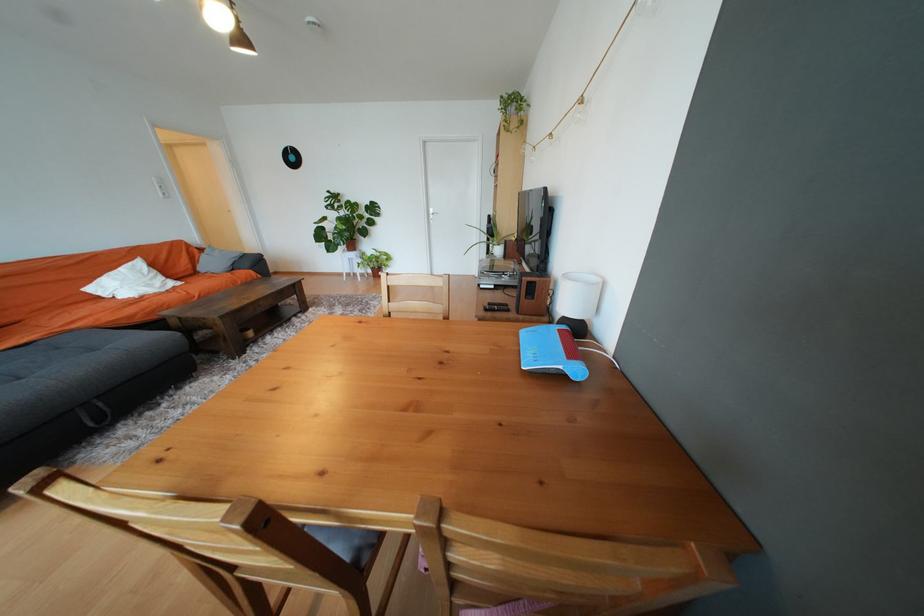
Image resolution: width=924 pixels, height=616 pixels. In order to click on white door handle in this screenshot , I will do `click(432, 213)`.